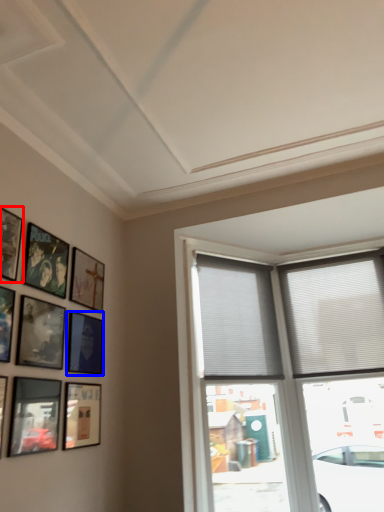
Question: Which of the following is the farthest to the observer, picture frame (highlighted by a red box) or picture frame (highlighted by a blue box)?

Choices:
 (A) picture frame
 (B) picture frame

Answer: (B)